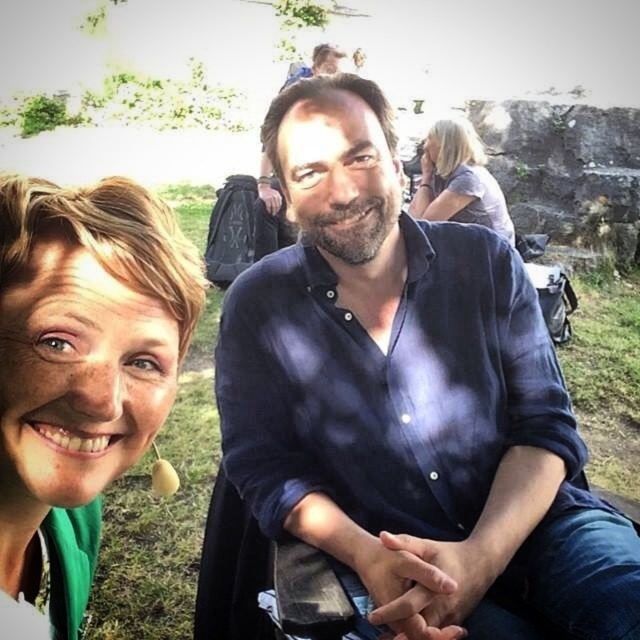
Based on the photo, is green fabric at left positioned in front of blonde hair at upper right?

Yes, it is.

Is point (22, 218) closer to camera compared to point (461, 144)?

Yes, it is.

Image resolution: width=640 pixels, height=640 pixels. What do you see at coordinates (81, 369) in the screenshot?
I see `green fabric at left` at bounding box center [81, 369].

Where is `green fabric at left`? Image resolution: width=640 pixels, height=640 pixels. green fabric at left is located at coordinates (81, 369).

Can you confirm if blue cotton shirt at center is smaller than green fabric at left?

No.

Which is more to the left, blue cotton shirt at center or green fabric at left?

green fabric at left is more to the left.

Does point (534, 369) come in front of point (10, 342)?

That is False.

Where is `blue cotton shirt at center`? blue cotton shirt at center is located at coordinates (401, 410).

Measure the distance between blue cotton shirt at center and blonde hair at upper right.

They are 2.50 meters apart.

Who is shorter, blue cotton shirt at center or blonde hair at upper right?

Standing shorter between the two is blonde hair at upper right.

You are a GUI agent. You are given a task and a screenshot of the screen. Output one action in this format:
    pyautogui.click(x=<x>, y=<y>)
    Task: Click on the blue cotton shirt at center
    Image resolution: width=640 pixels, height=640 pixels.
    Given the screenshot: What is the action you would take?
    pyautogui.click(x=401, y=410)